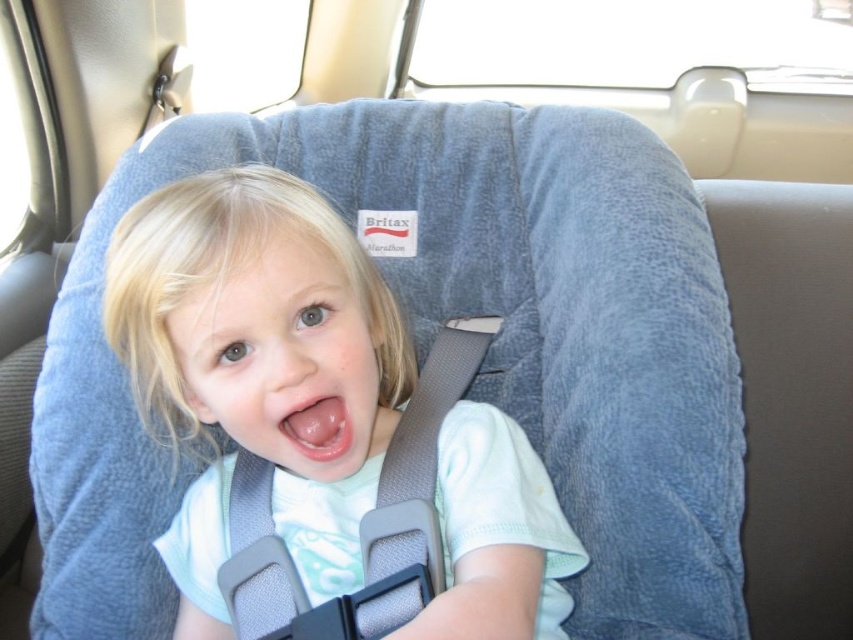
Question: Which point is closer to the camera?

Choices:
 (A) (218, 380)
 (B) (314, 444)

Answer: (A)

Question: Does matte gray car seat at center appear under pink glossy tongue at center?

Choices:
 (A) no
 (B) yes

Answer: (B)

Question: Can you confirm if matte gray car seat at center is positioned above pink glossy tongue at center?

Choices:
 (A) yes
 (B) no

Answer: (B)

Question: Does matte gray car seat at center appear over pink glossy tongue at center?

Choices:
 (A) no
 (B) yes

Answer: (A)